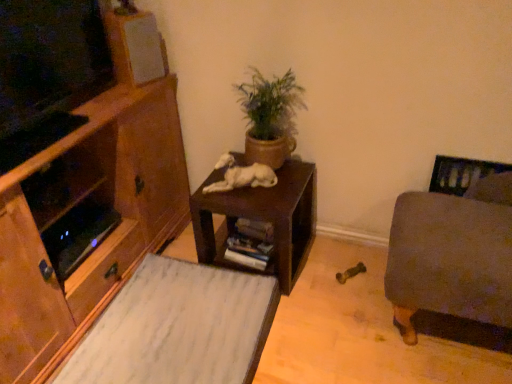
What are the coordinates of `vacant area in front of green matte plant pot at center` in the screenshot? It's located at (258, 200).